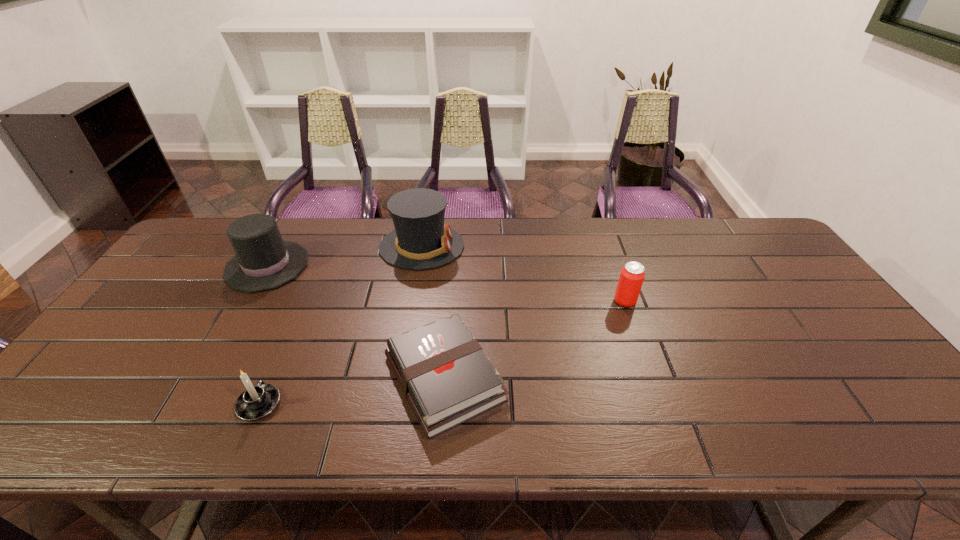
Image resolution: width=960 pixels, height=540 pixels. Identify the location of vacant space that satisfies the following two spatial constraints: 1. on the front of the left dress hat with the decoration; 2. on the back side of the rightmost object. (247, 301).

Where is `free spot that satisfies the following two spatial constraints: 1. with a handle on the side of the third farthest object; 2. on the right side of the candle holder`? This screenshot has width=960, height=540. free spot that satisfies the following two spatial constraints: 1. with a handle on the side of the third farthest object; 2. on the right side of the candle holder is located at coordinates [x=303, y=301].

Find the location of a particular element. The width and height of the screenshot is (960, 540). vacant space that satisfies the following two spatial constraints: 1. on the front of the rightmost object with the decoration; 2. on the right side of the left dress hat is located at coordinates (247, 301).

Where is `vacant point that satisfies the following two spatial constraints: 1. with a handle on the side of the third nearest object; 2. on the right side of the candle holder`? The height and width of the screenshot is (540, 960). vacant point that satisfies the following two spatial constraints: 1. with a handle on the side of the third nearest object; 2. on the right side of the candle holder is located at coordinates (303, 301).

Where is `vacant area that satisfies the following two spatial constraints: 1. with a handle on the side of the candle holder; 2. on the left side of the shortest object`? vacant area that satisfies the following two spatial constraints: 1. with a handle on the side of the candle holder; 2. on the left side of the shortest object is located at coordinates (271, 378).